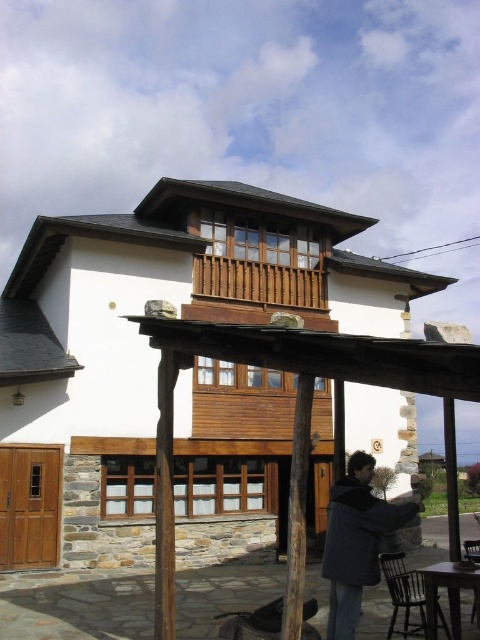
You are standing in front of the house and notice two wooden structures. The wooden pergola at center and the wooden at upper center. Which one is located to the right of the other?

The wooden pergola at center is positioned on the right side of wooden at upper center.

You are standing in front of the house and want to install a new light fixture. The wooden pergola at center and the wooden at upper center are both potential locations. Which one is closer to the ground?

The wooden pergola at center is positioned under wooden at upper center, so the wooden pergola at center is closer to the ground.

You are planning to install a new bench in the garden area near the wooden pergola at center and the dark gray jacket at center. Considering their sizes, which object should the bench be placed closer to for better visibility?

The bench should be placed closer to the wooden pergola at center since it has a larger size compared to the dark gray jacket at center, making it a more prominent landmark for visibility.